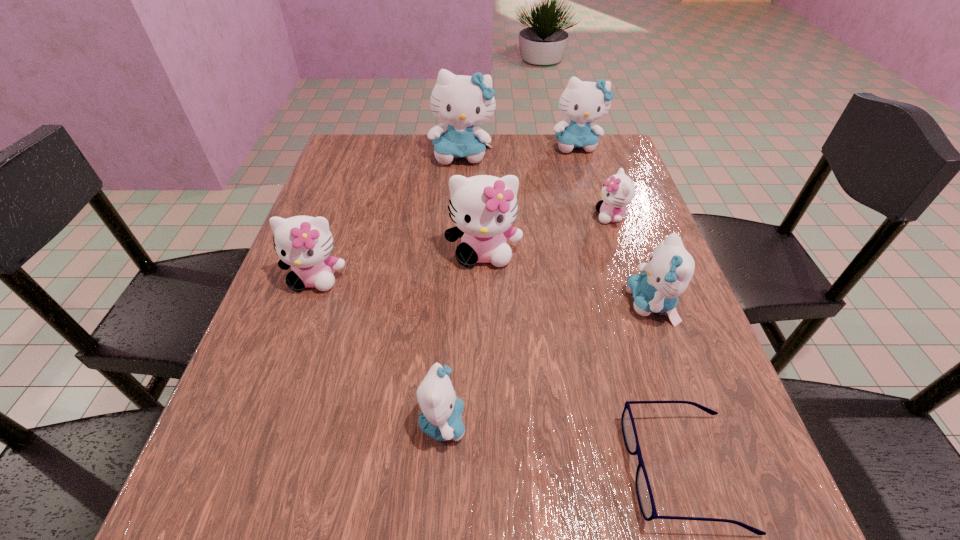
You are a GUI agent. You are given a task and a screenshot of the screen. Output one action in this format:
    pyautogui.click(x=<x>, y=<y>)
    Task: Click on the vacant area between the third smallest blue kitten and the rightmost white kitten
    
    Given the screenshot: What is the action you would take?
    pyautogui.click(x=593, y=181)

Find the location of a particular element. empty location between the third farthest blue kitten and the tallest object is located at coordinates (557, 230).

Identify the location of unoccupied area between the leftmost object and the nearest blue kitten. (379, 350).

Image resolution: width=960 pixels, height=540 pixels. Find the location of `free spot between the second white kitten from right to left and the farthest white kitten`. free spot between the second white kitten from right to left and the farthest white kitten is located at coordinates (547, 234).

Locate an element on the screen. The image size is (960, 540). object that ranks as the seventh closest to the tallest kitten is located at coordinates (644, 493).

Point out which object is positioned as the nearest to the third biggest blue kitten. Please provide its 2D coordinates. Your answer should be formatted as a tuple, i.e. [(x, y)], where the tuple contains the x and y coordinates of a point satisfying the conditions above.

[(618, 191)]

Where is `kitten that is the fourth closest to the smallest white kitten`? The height and width of the screenshot is (540, 960). kitten that is the fourth closest to the smallest white kitten is located at coordinates (461, 101).

Point out which kitten is positioned as the third nearest to the nearest blue kitten. Please provide its 2D coordinates. Your answer should be formatted as a tuple, i.e. [(x, y)], where the tuple contains the x and y coordinates of a point satisfying the conditions above.

[(670, 268)]

Locate an element on the screen. The height and width of the screenshot is (540, 960). the third closest blue kitten to the tallest object is located at coordinates (441, 418).

Image resolution: width=960 pixels, height=540 pixels. Find the location of `blue kitten that is the third closest to the second smallest blue kitten`. blue kitten that is the third closest to the second smallest blue kitten is located at coordinates (461, 101).